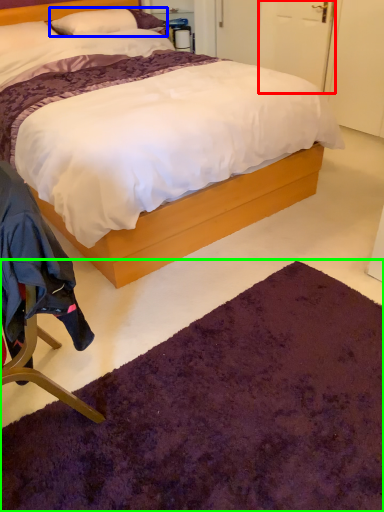
Question: Which object is positioned closest to door (highlighted by a red box)? Select from pillow (highlighted by a blue box) and mat (highlighted by a green box).

Choices:
 (A) pillow
 (B) mat

Answer: (A)